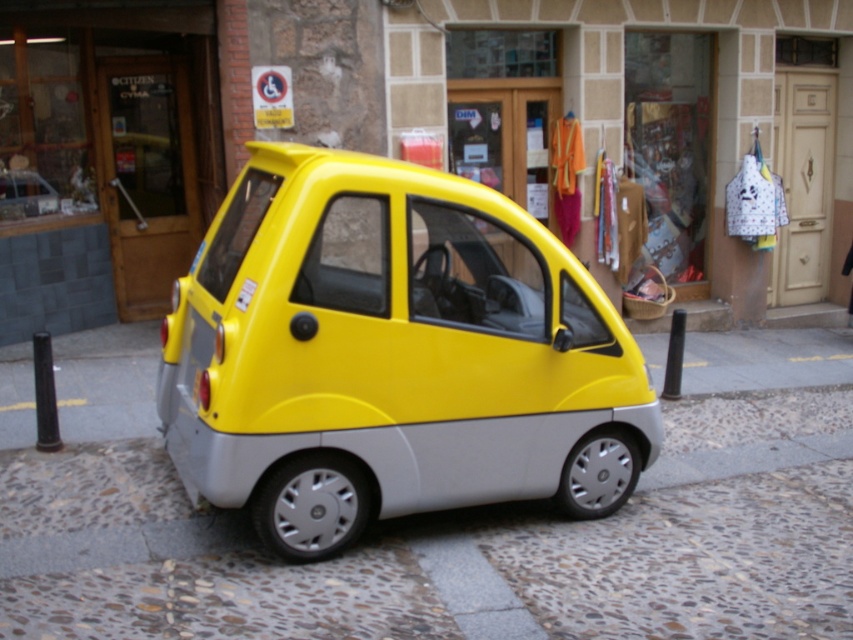
Question: Which object appears farthest from the camera in this image?

Choices:
 (A) yellow matte pavement at lower center
 (B) matte glass storefront at center
 (C) yellow matte car at center

Answer: (B)

Question: Which point is farther to the camera?

Choices:
 (A) yellow matte car at center
 (B) yellow matte pavement at lower center

Answer: (B)

Question: Is yellow matte car at center positioned before matte glass storefront at center?

Choices:
 (A) yes
 (B) no

Answer: (A)

Question: From the image, what is the correct spatial relationship of yellow matte car at center in relation to matte glass storefront at center?

Choices:
 (A) above
 (B) below

Answer: (B)

Question: Does yellow matte car at center lie behind matte glass storefront at center?

Choices:
 (A) yes
 (B) no

Answer: (B)

Question: Which point is farther to the camera?

Choices:
 (A) yellow matte car at center
 (B) yellow matte pavement at lower center

Answer: (B)